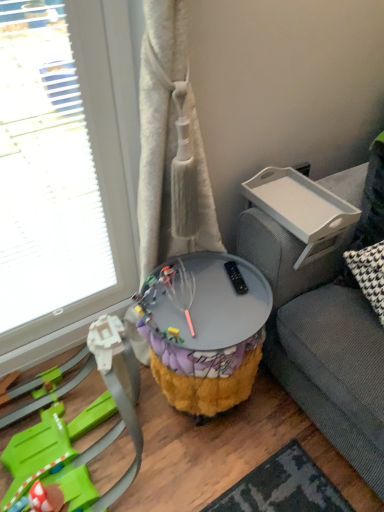
Question: Does fuzzy fabric side table at center, acting as the 2th table starting from the top, have a lesser height compared to plush yellow and purple toy at lower left?

Choices:
 (A) no
 (B) yes

Answer: (A)

Question: From a real-world perspective, is fuzzy fabric side table at center, acting as the 2th table starting from the top, below plush yellow and purple toy at lower left?

Choices:
 (A) no
 (B) yes

Answer: (A)

Question: Is fuzzy fabric side table at center, which is the first table from bottom to top, in front of plush yellow and purple toy at lower left?

Choices:
 (A) yes
 (B) no

Answer: (B)

Question: Does fuzzy fabric side table at center, acting as the 2th table starting from the top, appear on the right side of plush yellow and purple toy at lower left?

Choices:
 (A) yes
 (B) no

Answer: (A)

Question: Does fuzzy fabric side table at center, which is the first table from bottom to top, come behind plush yellow and purple toy at lower left?

Choices:
 (A) yes
 (B) no

Answer: (A)

Question: From the image's perspective, is transparent glass door at left above or below fuzzy fabric side table at center, acting as the 2th table starting from the top?

Choices:
 (A) below
 (B) above

Answer: (B)

Question: From a real-world perspective, is transparent glass door at left physically located above or below fuzzy fabric side table at center, acting as the 2th table starting from the top?

Choices:
 (A) below
 (B) above

Answer: (B)

Question: Is transparent glass door at left wider or thinner than fuzzy fabric side table at center, acting as the 2th table starting from the top?

Choices:
 (A) thin
 (B) wide

Answer: (A)

Question: Is transparent glass door at left situated inside fuzzy fabric side table at center, acting as the 2th table starting from the top, or outside?

Choices:
 (A) inside
 (B) outside

Answer: (B)

Question: From a real-world perspective, is transparent glass door at left positioned above or below plush yellow and purple toy at lower left?

Choices:
 (A) below
 (B) above

Answer: (B)

Question: Considering the positions of transparent glass door at left and plush yellow and purple toy at lower left in the image, is transparent glass door at left wider or thinner than plush yellow and purple toy at lower left?

Choices:
 (A) wide
 (B) thin

Answer: (B)

Question: Is transparent glass door at left inside the boundaries of plush yellow and purple toy at lower left, or outside?

Choices:
 (A) inside
 (B) outside

Answer: (B)

Question: In terms of height, does transparent glass door at left look taller or shorter compared to plush yellow and purple toy at lower left?

Choices:
 (A) tall
 (B) short

Answer: (A)

Question: Considering the positions of point (279, 195) and point (51, 474), is point (279, 195) closer or farther from the camera than point (51, 474)?

Choices:
 (A) closer
 (B) farther

Answer: (B)

Question: Is white plastic tray at upper right, the second table ordered from the bottom, inside or outside of plush yellow and purple toy at lower left?

Choices:
 (A) outside
 (B) inside

Answer: (A)